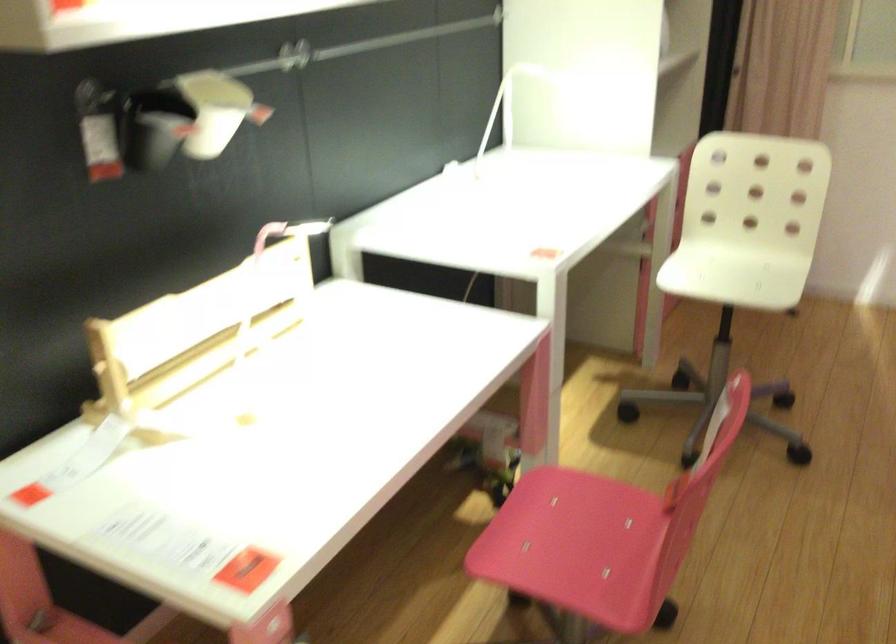
The first image is from the beginning of the video and the second image is from the end. How did the camera likely rotate when shooting the video?

The camera rotated toward left-down.